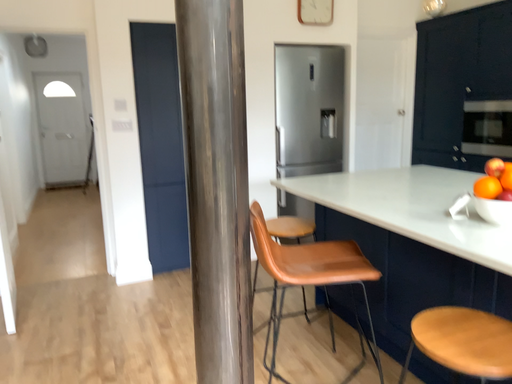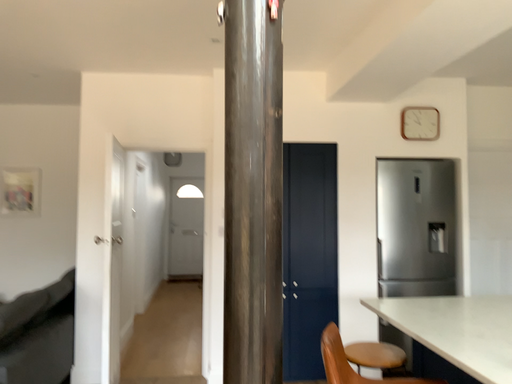
Question: How did the camera likely rotate when shooting the video?

Choices:
 (A) rotated right
 (B) rotated left

Answer: (B)